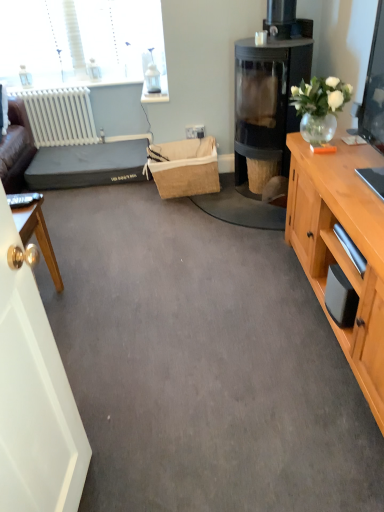
You are a GUI agent. You are given a task and a screenshot of the screen. Output one action in this format:
    pyautogui.click(x=<x>, y=<y>)
    Task: Click on the free region under polished wood desk at left (from a real-world perspective)
    
    Given the screenshot: What is the action you would take?
    pyautogui.click(x=53, y=304)